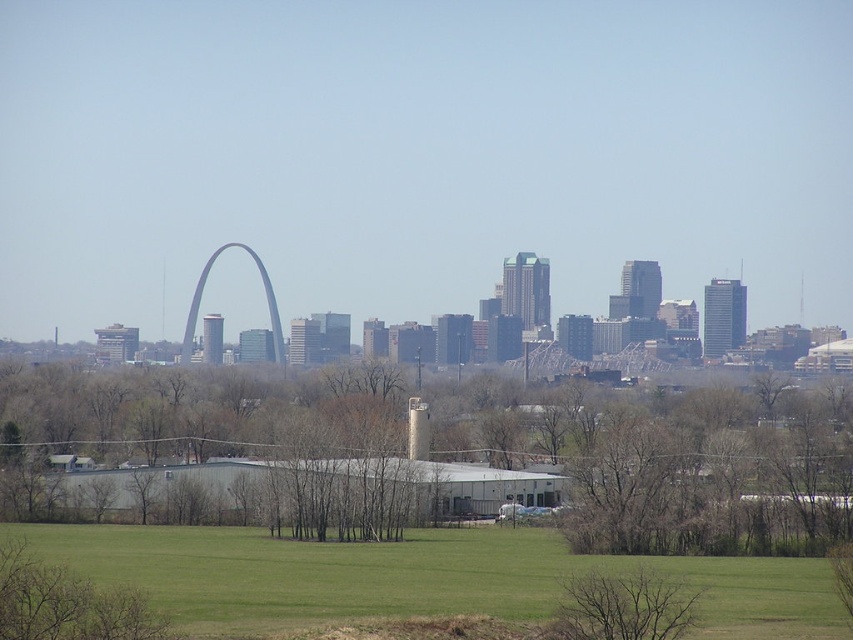
Is bare branches at lower center wider than matte gray arch at center?

No, bare branches at lower center is not wider than matte gray arch at center.

Is bare branches at lower center closer to camera compared to matte gray arch at center?

Yes, bare branches at lower center is closer to the viewer.

Image resolution: width=853 pixels, height=640 pixels. What are the coordinates of `bare branches at lower center` in the screenshot? It's located at (622, 609).

Does green leafy tree at center appear over green grass at lower center?

Correct, green leafy tree at center is located above green grass at lower center.

Where is `green leafy tree at center`? green leafy tree at center is located at coordinates (682, 465).

Locate an element on the screen. This screenshot has height=640, width=853. green leafy tree at center is located at coordinates (x=682, y=465).

Does green grass at lower center have a smaller size compared to bare branches at lower center?

Actually, green grass at lower center might be larger than bare branches at lower center.

From the picture: Is green grass at lower center to the left of bare branches at lower center from the viewer's perspective?

Correct, you'll find green grass at lower center to the left of bare branches at lower center.

Which is in front, point (97, 525) or point (578, 588)?

Point (578, 588) is more forward.

Find the location of a particular element. The width and height of the screenshot is (853, 640). green grass at lower center is located at coordinates point(416,579).